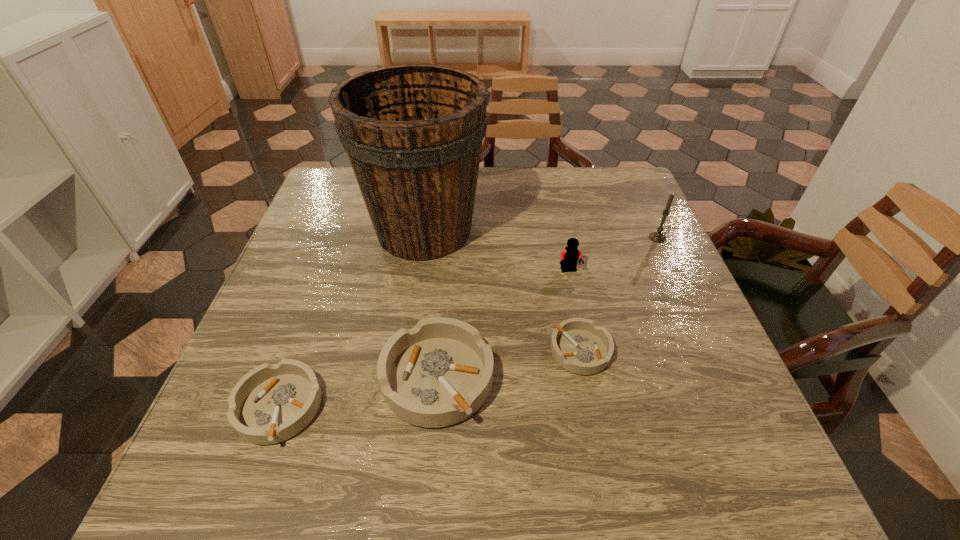
The image size is (960, 540). I want to click on vacant space located on the right of the second shortest object, so point(359,408).

Locate an element on the screen. Image resolution: width=960 pixels, height=540 pixels. vacant region located on the back of the fourth tallest object is located at coordinates (444, 299).

Identify the location of vacant space situated on the back of the shortest object. (555, 226).

At what (x,y) coordinates should I click in order to perform the action: click on free region located 0.250m on the front of the bucket. Please return your answer as a coordinate pair (x, y). Looking at the image, I should click on (405, 361).

Find the location of a particular element. vacant space located on the front-facing side of the Lego is located at coordinates click(578, 311).

Image resolution: width=960 pixels, height=540 pixels. Identify the location of vacant area situated on the front of the rightmost object. (699, 328).

Image resolution: width=960 pixels, height=540 pixels. I want to click on object located at the far edge, so click(413, 133).

Identify the location of object that is at the left edge. [x=271, y=403].

Identify the location of object present at the right edge. The width and height of the screenshot is (960, 540). (658, 237).

Find the location of a particular element. Image resolution: width=960 pixels, height=540 pixels. object at the near left corner is located at coordinates (271, 403).